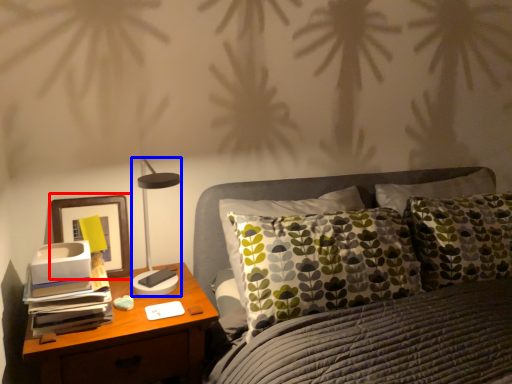
Question: Which point is closer to the camera, picture frame (highlighted by a red box) or table lamp (highlighted by a blue box)?

Choices:
 (A) picture frame
 (B) table lamp

Answer: (B)